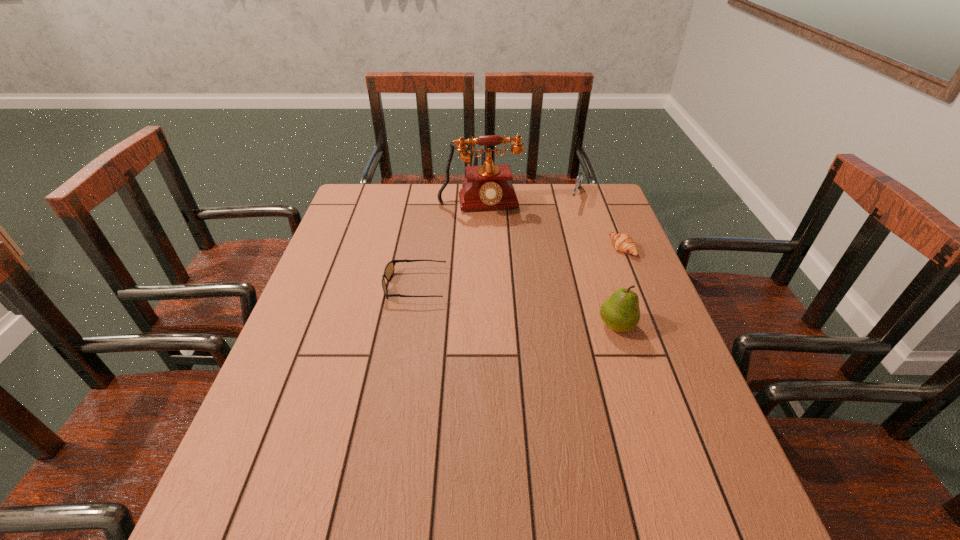
Where is `pistol that is at the far edge`? The height and width of the screenshot is (540, 960). pistol that is at the far edge is located at coordinates (579, 178).

Image resolution: width=960 pixels, height=540 pixels. What are the coordinates of `pear located in the right edge section of the desktop` in the screenshot? It's located at (620, 312).

I want to click on pastry located in the right edge section of the desktop, so click(x=622, y=242).

At what (x,y) coordinates should I click in order to perform the action: click on pistol that is at the right edge. Please return your answer as a coordinate pair (x, y). Image resolution: width=960 pixels, height=540 pixels. Looking at the image, I should click on (579, 178).

The image size is (960, 540). I want to click on object positioned at the far right corner, so click(x=579, y=178).

Locate an element on the screen. vacant space at the far edge is located at coordinates (417, 204).

Find the location of `free space at the near edge`. free space at the near edge is located at coordinates (584, 448).

The height and width of the screenshot is (540, 960). In the image, there is a desktop. In order to click on free space at the left edge in this screenshot , I will do `click(374, 243)`.

Identify the location of free region at the right edge. (577, 231).

Where is `vacant space at the far left corner of the desktop`? This screenshot has height=540, width=960. vacant space at the far left corner of the desktop is located at coordinates (390, 189).